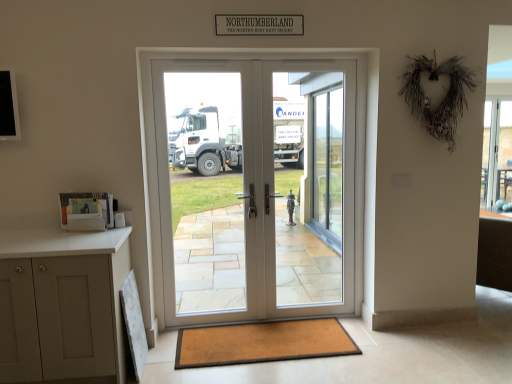
Where is `empty space that is ontop of white glossy door at center, which is the first screen door in left-to-right order (from a real-world perspective)`? This screenshot has height=384, width=512. empty space that is ontop of white glossy door at center, which is the first screen door in left-to-right order (from a real-world perspective) is located at coordinates (200, 58).